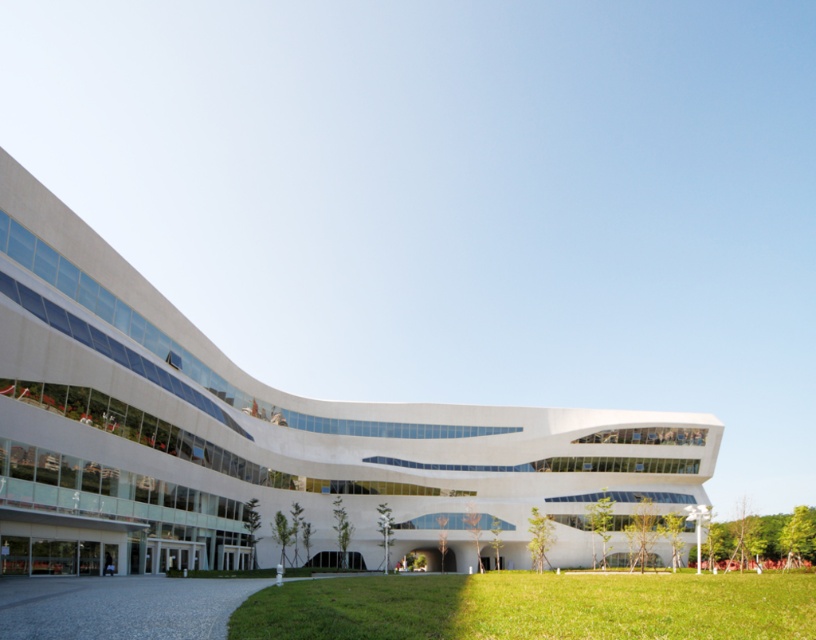
You are a landscape architect designing a new garden. You need to place a large sculpture that requires a space wider than the green grass at lower center. Can the white smooth building at center provide enough width for this sculpture?

The white smooth building at center is wider than the green grass at lower center, so it can accommodate the sculpture requiring more width than the green grass at lower center.

You are standing on the green grass at lower center and want to reach the entrance of the white smooth building at center. Which direction should you walk to get closer to the building?

Since the white smooth building at center is further to the viewer than the green grass at lower center, you should walk away from the current position towards the direction of the building to reach its entrance.